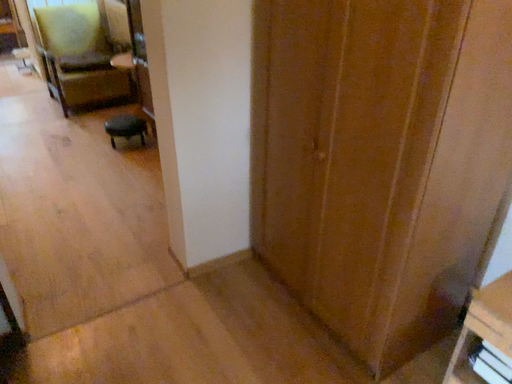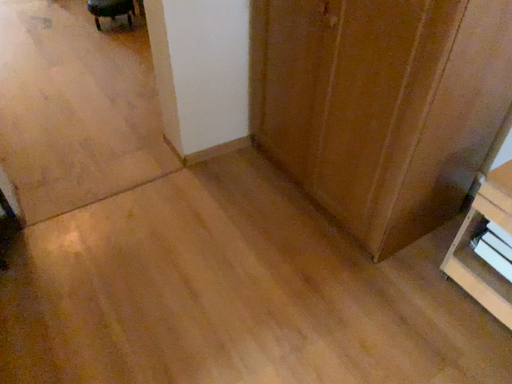
Question: Which way did the camera rotate in the video?

Choices:
 (A) rotated upward
 (B) rotated downward

Answer: (B)